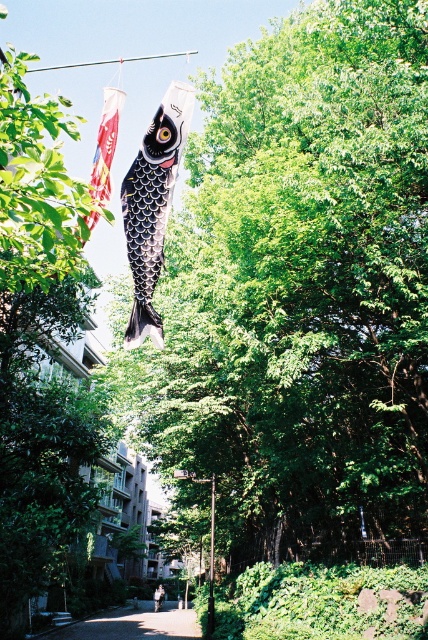
Question: Estimate the real-world distances between objects in this image. Which object is closer to the green leafy tree at upper center?

Choices:
 (A) black glossy fish at center
 (B) smooth concrete path at center

Answer: (A)

Question: Based on their relative distances, which object is nearer to the green leafy tree at center?

Choices:
 (A) green leafy tree at upper center
 (B) black glossy fish at center
 (C) smooth concrete path at center

Answer: (A)

Question: Can you confirm if green leafy tree at center is thinner than green leafy tree at upper center?

Choices:
 (A) no
 (B) yes

Answer: (B)

Question: Is black glossy fish at center above smooth concrete path at center?

Choices:
 (A) yes
 (B) no

Answer: (A)

Question: Which point is farther to the camera?

Choices:
 (A) black glossy fish at center
 (B) smooth concrete path at center
 (C) green leafy tree at upper center

Answer: (B)

Question: Is green leafy tree at center smaller than smooth concrete path at center?

Choices:
 (A) yes
 (B) no

Answer: (B)